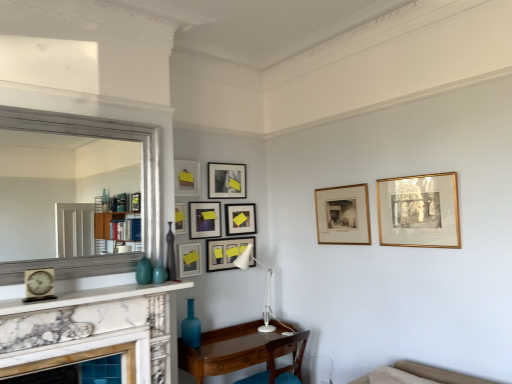
You are a GUI agent. You are given a task and a screenshot of the screen. Output one action in this format:
    pyautogui.click(x=<x>, y=<y>)
    Task: Click on the free space to the left of matte glass vase at center, which appears as the second turquoise when viewed from the right
    The image size is (512, 384).
    Given the screenshot: What is the action you would take?
    pyautogui.click(x=122, y=283)